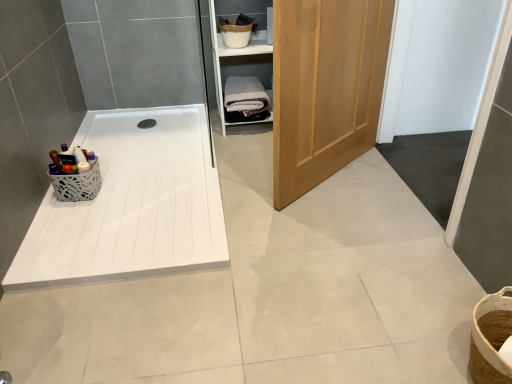
Question: Relative to white lace basket at left, is wooden cabinet at upper right in front or behind?

Choices:
 (A) behind
 (B) front

Answer: (A)

Question: Considering the positions of wooden cabinet at upper right and white lace basket at left in the image, is wooden cabinet at upper right wider or thinner than white lace basket at left?

Choices:
 (A) thin
 (B) wide

Answer: (B)

Question: Based on their relative distances, which object is nearer to the light brown wood door at center?

Choices:
 (A) white lace basket at left
 (B) white glossy bath at left
 (C) white cotton bath towel at center
 (D) wooden cabinet at upper right
 (E) black rubber drain at center

Answer: (B)

Question: Based on their relative distances, which object is nearer to the white glossy bath at left?

Choices:
 (A) white cotton bath towel at center
 (B) light brown wood door at center
 (C) wooden cabinet at upper right
 (D) white lace basket at left
 (E) black rubber drain at center

Answer: (D)